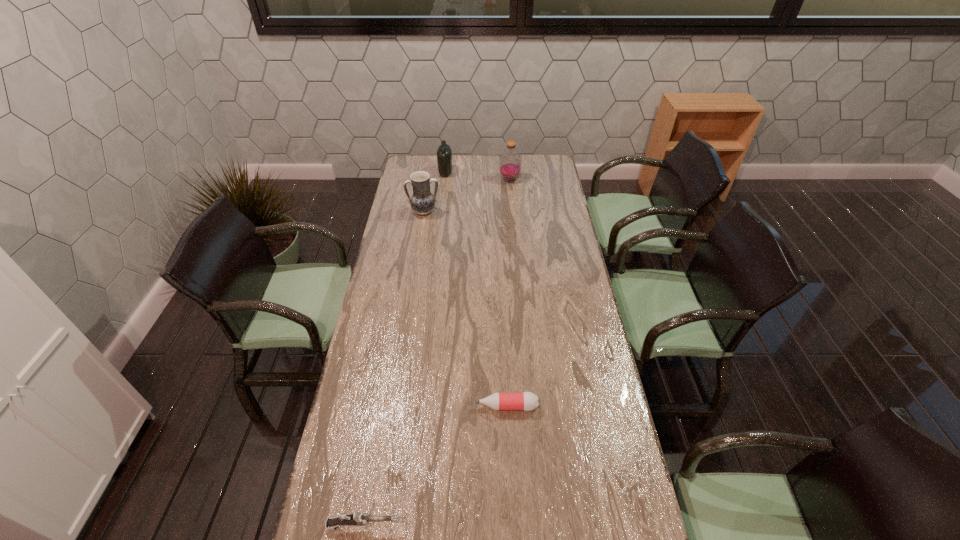
Find the location of `free spot located with the cap open on the fourth farthest object`. free spot located with the cap open on the fourth farthest object is located at coordinates (444, 406).

Locate an element on the screen. This screenshot has width=960, height=540. free spot located 0.320m with the cap open on the fourth farthest object is located at coordinates (374, 406).

Where is `pottery present at the left edge`? pottery present at the left edge is located at coordinates (422, 201).

Locate an element on the screen. Image resolution: width=960 pixels, height=540 pixels. gun present at the left edge is located at coordinates (356, 518).

In the image, there is a desktop. Identify the location of blank space at the far edge. (466, 172).

The height and width of the screenshot is (540, 960). In order to click on free space at the left edge of the desktop in this screenshot , I will do `click(381, 284)`.

I want to click on vacant space at the right edge of the desktop, so click(579, 281).

The height and width of the screenshot is (540, 960). Identify the location of vacant space at the far left corner. (415, 161).

Identify the location of free space between the shortest object and the leftmost bottle. (476, 289).

What are the coordinates of `free point between the fourth tallest object and the third farthest object` in the screenshot? It's located at (394, 369).